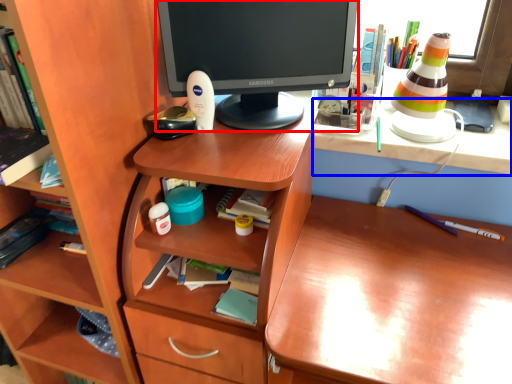
Question: Which object is further to the camera taking this photo, computer monitor (highlighted by a red box) or computer (highlighted by a blue box)?

Choices:
 (A) computer monitor
 (B) computer

Answer: (B)